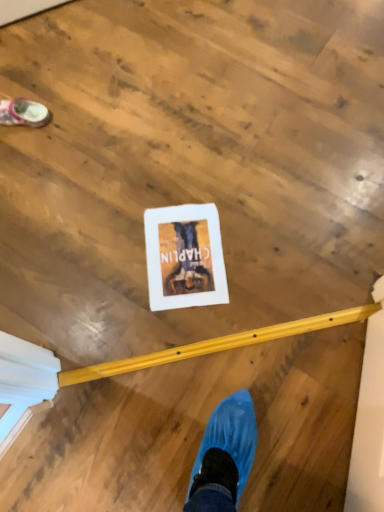
Where is `free area in between white paper at center and white fabric shoe at upper left`? The image size is (384, 512). free area in between white paper at center and white fabric shoe at upper left is located at coordinates (99, 187).